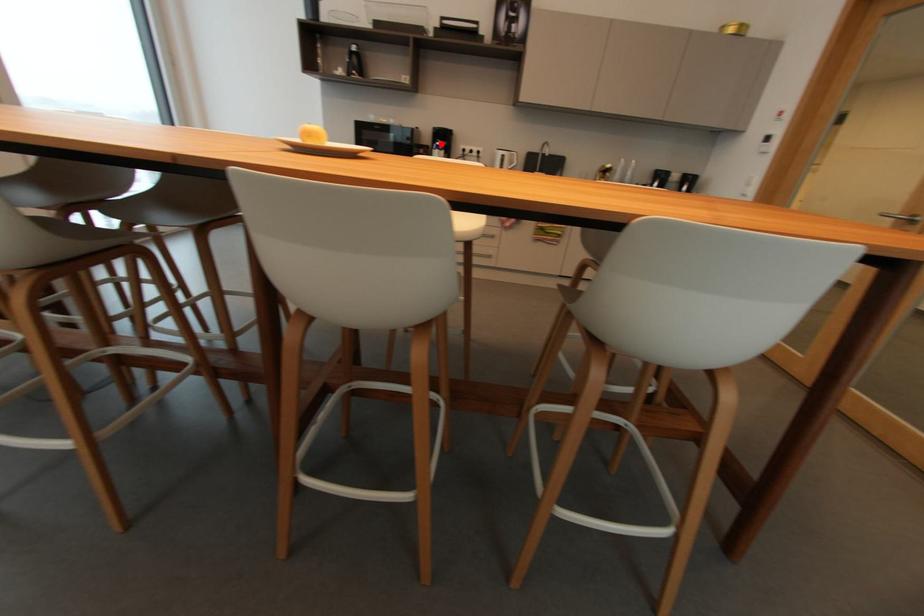
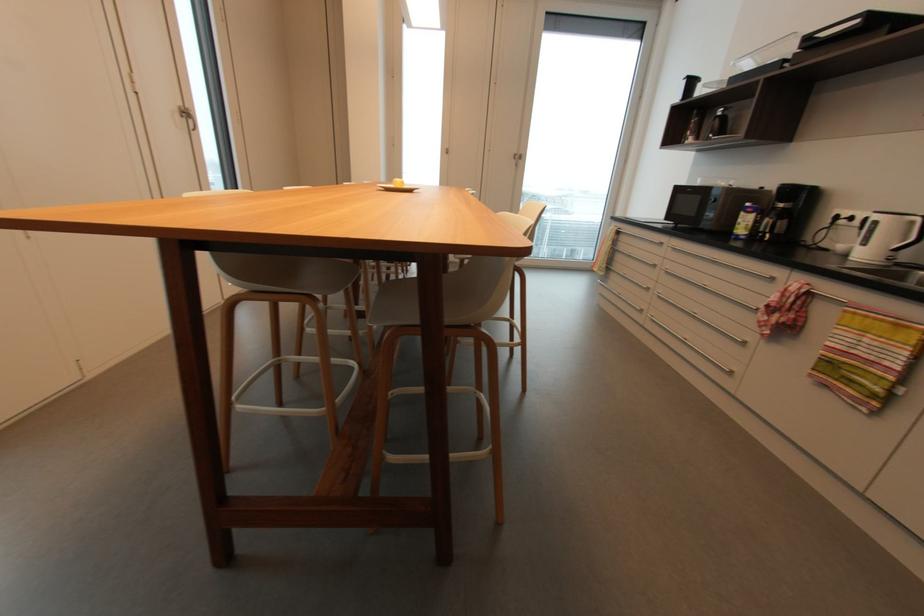
The point at the highlighted location is marked in the first image. Where is the corresponding point in the second image?

(750, 205)